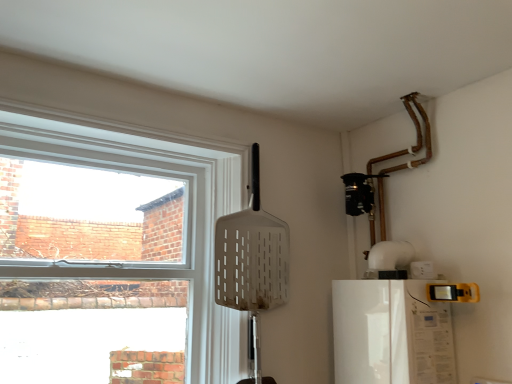
Question: Which is correct: clear glass window at upper left is inside white glossy refrigerator at lower right, or outside of it?

Choices:
 (A) outside
 (B) inside

Answer: (A)

Question: From the image's perspective, is clear glass window at upper left positioned above or below white glossy refrigerator at lower right?

Choices:
 (A) above
 (B) below

Answer: (A)

Question: Does point (180, 135) appear closer or farther from the camera than point (415, 329)?

Choices:
 (A) closer
 (B) farther

Answer: (B)

Question: Is white glossy refrigerator at lower right in front of or behind clear glass window at upper left in the image?

Choices:
 (A) front
 (B) behind

Answer: (B)

Question: Considering the positions of point (398, 294) and point (201, 374), is point (398, 294) closer or farther from the camera than point (201, 374)?

Choices:
 (A) closer
 (B) farther

Answer: (A)

Question: From the image's perspective, relative to clear glass window at upper left, is white glossy refrigerator at lower right above or below?

Choices:
 (A) below
 (B) above

Answer: (A)

Question: In the image, is white glossy refrigerator at lower right on the left side or the right side of clear glass window at upper left?

Choices:
 (A) right
 (B) left

Answer: (A)